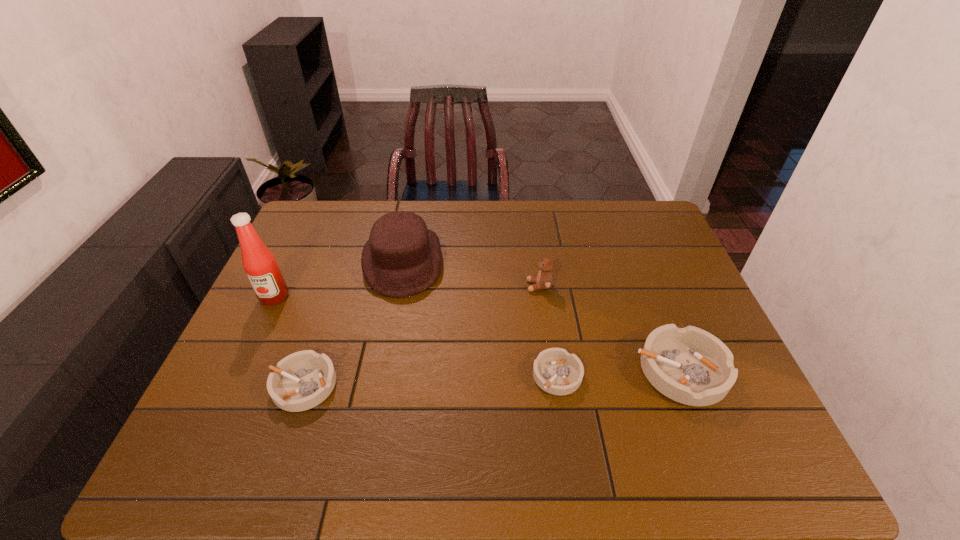
Locate an element on the screen. The width and height of the screenshot is (960, 540). condiment positioned at the left edge is located at coordinates (260, 265).

Find the location of a particular element. Image resolution: width=960 pixels, height=540 pixels. object that is positioned at the right edge is located at coordinates (689, 365).

Locate an element on the screen. The width and height of the screenshot is (960, 540). object located in the near left corner section of the desktop is located at coordinates (302, 380).

The width and height of the screenshot is (960, 540). Identify the location of object located at the near right corner. (689, 365).

The height and width of the screenshot is (540, 960). In order to click on vacant space at the far edge of the desktop in this screenshot , I will do `click(572, 238)`.

At what (x,y) coordinates should I click in order to perform the action: click on free space at the near edge. Please return your answer as a coordinate pair (x, y). The width and height of the screenshot is (960, 540). Looking at the image, I should click on (566, 410).

Locate an element on the screen. vacant region at the left edge of the desktop is located at coordinates (254, 357).

This screenshot has height=540, width=960. In the image, there is a desktop. Find the location of `vacant space at the right edge`. vacant space at the right edge is located at coordinates (658, 298).

At what (x,y) coordinates should I click in order to perform the action: click on vacant space at the far left corner. Please return your answer as a coordinate pair (x, y). This screenshot has width=960, height=540. Looking at the image, I should click on (337, 239).

The height and width of the screenshot is (540, 960). In order to click on free space at the near left corner in this screenshot , I will do `click(240, 413)`.